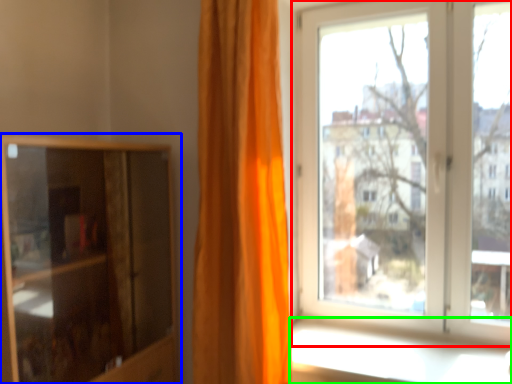
Question: Estimate the real-world distances between objects in this image. Which object is closer to window (highlighted by a red box), cupboard (highlighted by a blue box) or window sill (highlighted by a green box)?

Choices:
 (A) cupboard
 (B) window sill

Answer: (B)